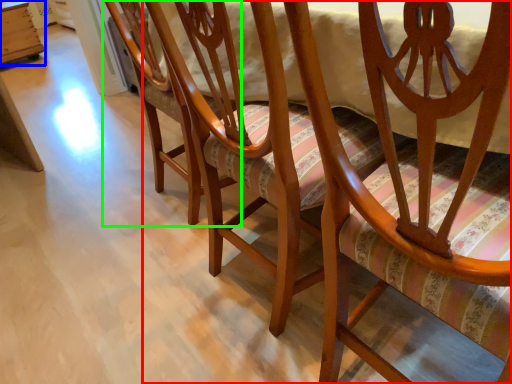
Question: Which object is positioned closest to chair (highlighted by a red box)? Select from table (highlighted by a blue box) and chair (highlighted by a green box).

Choices:
 (A) table
 (B) chair

Answer: (B)